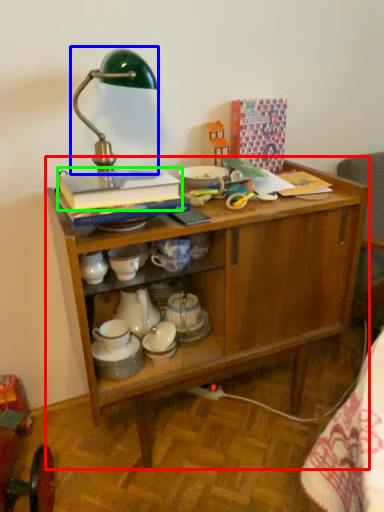
Question: Based on their relative distances, which object is nearer to desk (highlighted by a red box)? Choose from table lamp (highlighted by a blue box) and book (highlighted by a green box).

Choices:
 (A) table lamp
 (B) book

Answer: (B)